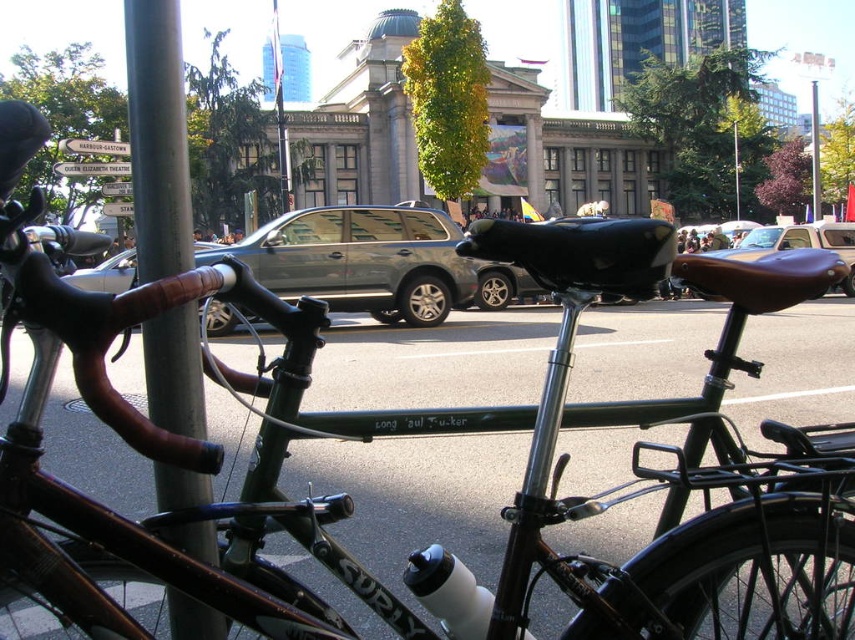
Where is `metallic gray suv at center`? This screenshot has height=640, width=855. metallic gray suv at center is located at coordinates (373, 262).

Which is in front, point (510, 296) or point (800, 236)?

Point (510, 296) is in front.

Is point (437, 227) closer to viewer compared to point (783, 240)?

Yes, it is in front of point (783, 240).

This screenshot has width=855, height=640. Find the location of `metallic gray suv at center`. metallic gray suv at center is located at coordinates (373, 262).

Who is positioned more to the right, metallic gray suv at center or brushed metal pole at center?

brushed metal pole at center is more to the right.

Can you confirm if metallic gray suv at center is positioned below brushed metal pole at center?

Yes.

Is point (402, 216) farther from camera compared to point (812, 90)?

No, it is in front of (812, 90).

Where is `metallic gray suv at center`? This screenshot has width=855, height=640. metallic gray suv at center is located at coordinates (373, 262).

Can you confirm if brown leather seat at center is taller than brushed metal pole at center?

Incorrect, brown leather seat at center's height is not larger of brushed metal pole at center's.

Does point (809, 225) come behind point (817, 108)?

That is False.

Describe the element at coordinates (799, 246) in the screenshot. I see `brown leather seat at center` at that location.

You are a GUI agent. You are given a task and a screenshot of the screen. Output one action in this format:
    pyautogui.click(x=<x>, y=<y>)
    Task: Click on the brown leather seat at center
    
    Given the screenshot: What is the action you would take?
    pyautogui.click(x=799, y=246)